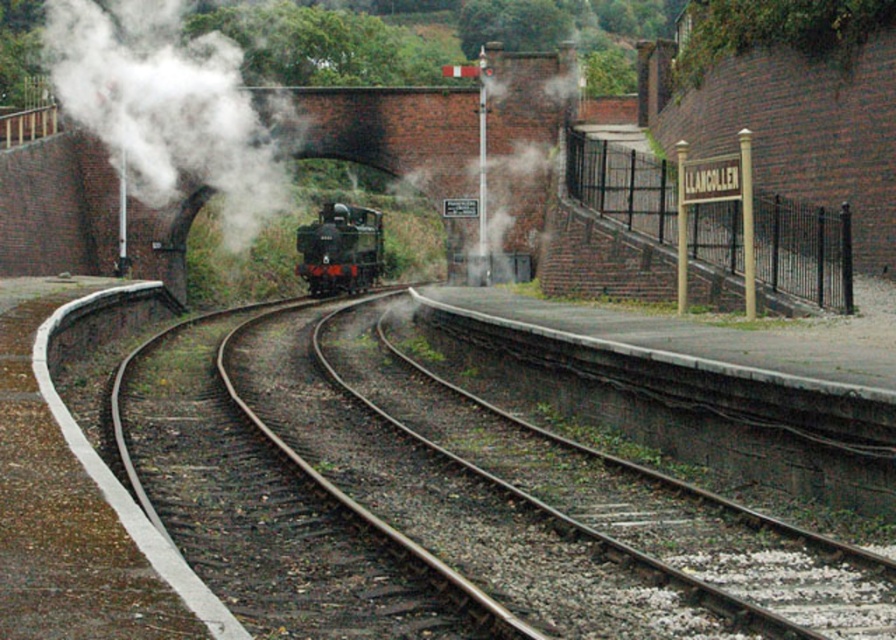
Question: In this image, where is gold metal sign at upper right located relative to green polished wood train at center?

Choices:
 (A) below
 (B) above

Answer: (A)

Question: Which of these objects is positioned closest to the white vapor at center?

Choices:
 (A) smooth steel tracks at center
 (B) green polished wood train at center
 (C) gold metal sign at upper right

Answer: (B)

Question: Which of these objects is positioned farthest from the smooth steel tracks at center?

Choices:
 (A) white vapor at center
 (B) gold metal sign at upper right
 (C) green polished wood train at center

Answer: (A)

Question: Does smooth steel tracks at center come in front of white vapor at center?

Choices:
 (A) yes
 (B) no

Answer: (A)

Question: Which point is farther to the camera?

Choices:
 (A) white vapor at center
 (B) smooth steel tracks at center
 (C) green polished wood train at center

Answer: (C)

Question: Is smooth steel tracks at center further to the viewer compared to gold metal sign at upper right?

Choices:
 (A) yes
 (B) no

Answer: (B)